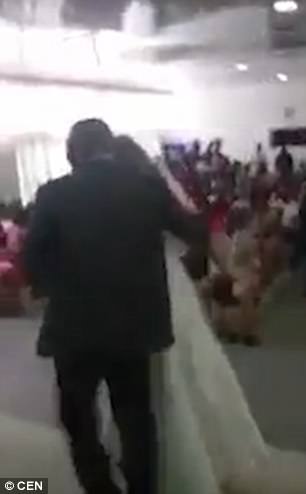
Where is `wall`? This screenshot has height=494, width=306. wall is located at coordinates (171, 377).